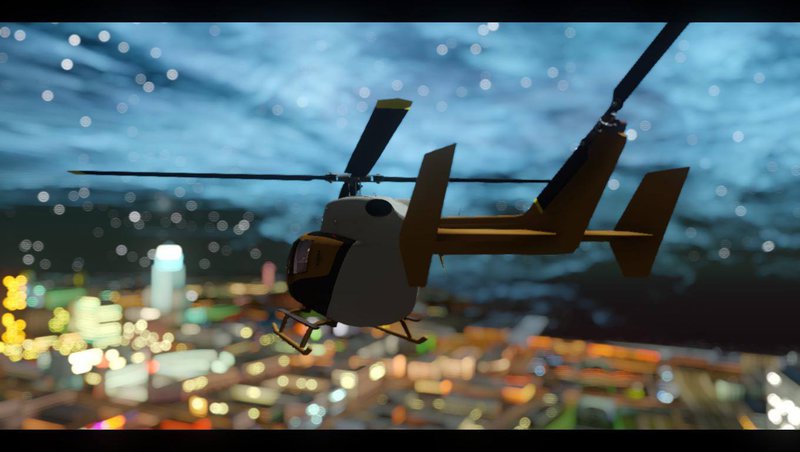
Find the location of `bright light`. bright light is located at coordinates (172, 251).